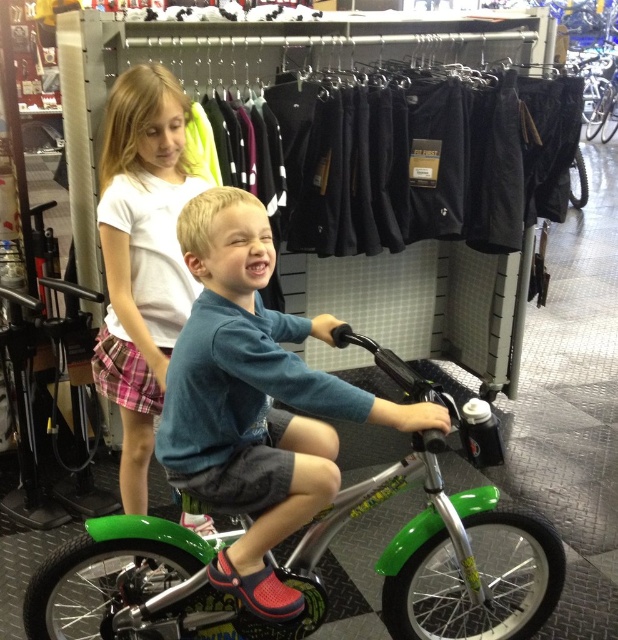
Question: Is green plastic bicycle at center to the left of white cotton shirt at upper left from the viewer's perspective?

Choices:
 (A) no
 (B) yes

Answer: (A)

Question: Which object is the farthest from the white cotton shirt at upper left?

Choices:
 (A) green metallic bicycle at center
 (B) green plastic bicycle at center

Answer: (B)

Question: Which point is farther from the camera taking this photo?

Choices:
 (A) 243,577
 (B) 106,273
 (C) 386,627

Answer: (C)

Question: Is green metallic bicycle at center positioned behind white cotton shirt at upper left?

Choices:
 (A) no
 (B) yes

Answer: (A)

Question: Which object is closer to the camera taking this photo?

Choices:
 (A) green metallic bicycle at center
 (B) green plastic bicycle at center

Answer: (A)

Question: Does green metallic bicycle at center have a greater width compared to white cotton shirt at upper left?

Choices:
 (A) no
 (B) yes

Answer: (B)